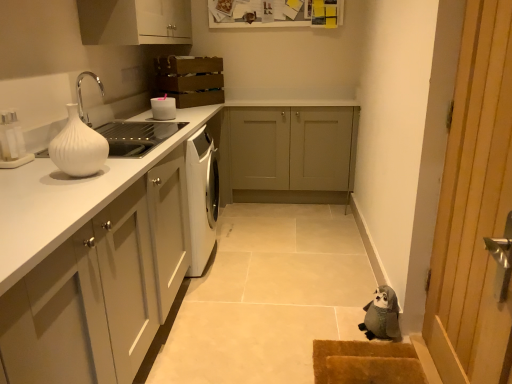
Question: In the image, is brown textured mat at lower right positioned in front of or behind gray fabric stuffed animal at lower right?

Choices:
 (A) front
 (B) behind

Answer: (A)

Question: In terms of width, does brown textured mat at lower right look wider or thinner when compared to gray fabric stuffed animal at lower right?

Choices:
 (A) wide
 (B) thin

Answer: (A)

Question: Considering the real-world distances, which object is closest to the brown textured mat at lower right?

Choices:
 (A) white glossy vase at left
 (B) matte gray cabinet at center, which is the 2th cabinetry from bottom to top
 (C) wooden door at right
 (D) white matte cabinet at upper center, which is the 2th cabinetry from front to back
 (E) white glossy bowl at upper left

Answer: (C)

Question: Based on their relative distances, which object is farther from the matte white cabinets at left, which is counted as the 1th cabinetry, starting from the bottom?

Choices:
 (A) brown textured mat at lower right
 (B) white glossy vase at left
 (C) white glossy countertop at left
 (D) white matte cabinet at upper center, the second cabinetry in the back-to-front sequence
 (E) wooden door at right

Answer: (D)